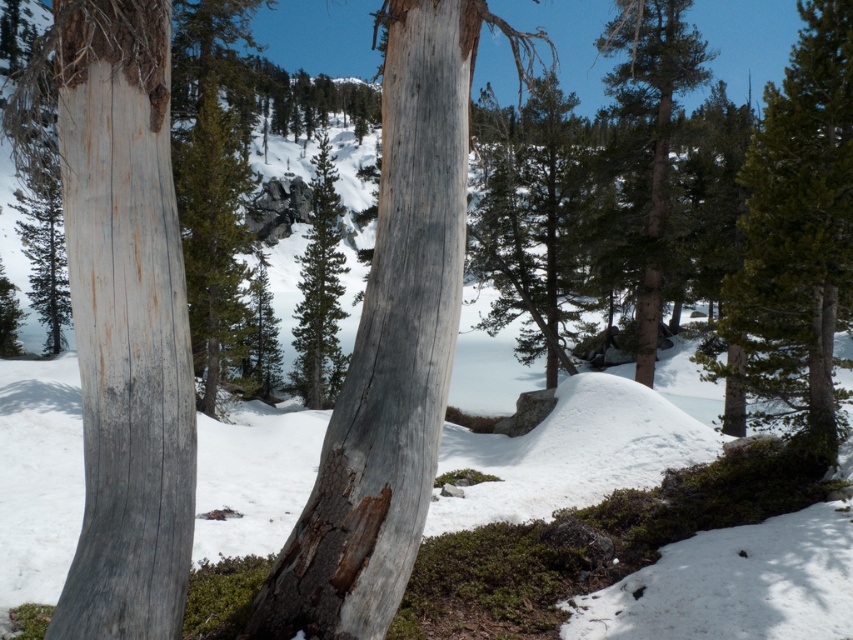
This screenshot has width=853, height=640. What do you see at coordinates (125, 321) in the screenshot? I see `gray wood tree trunk at center` at bounding box center [125, 321].

Which is above, gray wood tree trunk at center or green textured tree at right?

green textured tree at right is higher up.

Between point (149, 218) and point (763, 378), which one is positioned in front?

Point (149, 218) is in front.

What are the coordinates of `gray wood tree trunk at center` in the screenshot? It's located at (125, 321).

Is gray wood tree trunk at center further to the viewer compared to green textured pine tree at center?

No, it is not.

In the scene shown: Is gray wood tree trunk at center shorter than green textured pine tree at center?

Yes, gray wood tree trunk at center is shorter than green textured pine tree at center.

Identify the location of gray wood tree trunk at center. The width and height of the screenshot is (853, 640). (125, 321).

Between gray wood tree trunk at center and gray rough bark tree trunk at center, which one is positioned lower?

gray wood tree trunk at center is below.

Who is more forward, (x=132, y=61) or (x=384, y=300)?

Point (x=132, y=61)

Is point (109, 566) closer to viewer compared to point (379, 244)?

Yes, it is in front of point (379, 244).

Where is `gray wood tree trunk at center`? The image size is (853, 640). gray wood tree trunk at center is located at coordinates (125, 321).